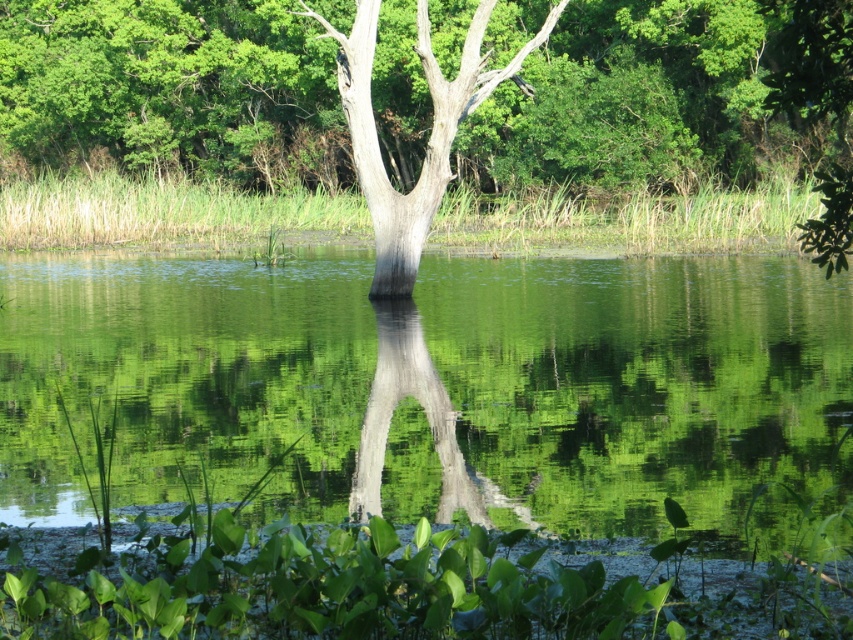
Who is lower down, green reflective water at center or smooth bark tree at center?

green reflective water at center is below.

Which is more to the right, green reflective water at center or smooth bark tree at center?

green reflective water at center

Is point (769, 525) farther from viewer compared to point (15, 70)?

No, it is not.

Identify the location of green reflective water at center. This screenshot has width=853, height=640. (436, 388).

Can you confirm if green reflective water at center is positioned to the left of smooth gray tree at center?

Incorrect, green reflective water at center is not on the left side of smooth gray tree at center.

Between point (811, 490) and point (408, 218), which one is positioned behind?

Point (408, 218)

Measure the distance between point (x=71, y=486) and camera.

Point (x=71, y=486) and camera are 47.32 feet apart.

Locate an element on the screen. Image resolution: width=853 pixels, height=640 pixels. green reflective water at center is located at coordinates (436, 388).

Between green reflective water at center and smooth gray tree trunk at center, which one is positioned lower?

smooth gray tree trunk at center is lower down.

Is the position of green reflective water at center less distant than that of smooth gray tree trunk at center?

Yes, green reflective water at center is closer to the viewer.

Is point (271, 445) positioned before point (454, 444)?

No, (271, 445) is further to viewer.

Find the location of a particular element. green reflective water at center is located at coordinates (436, 388).